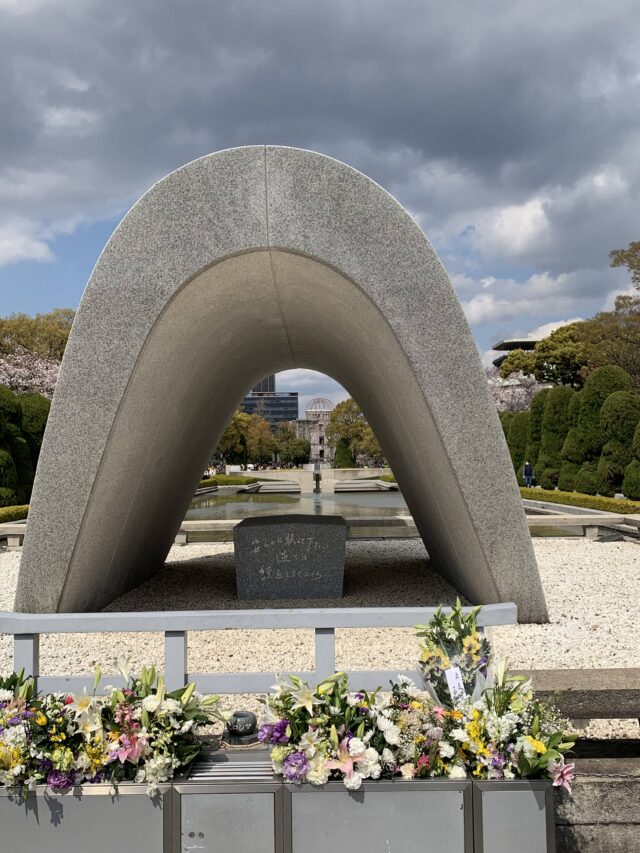
Identify the location of place to sit. This screenshot has width=640, height=853. (243, 761), (305, 518).